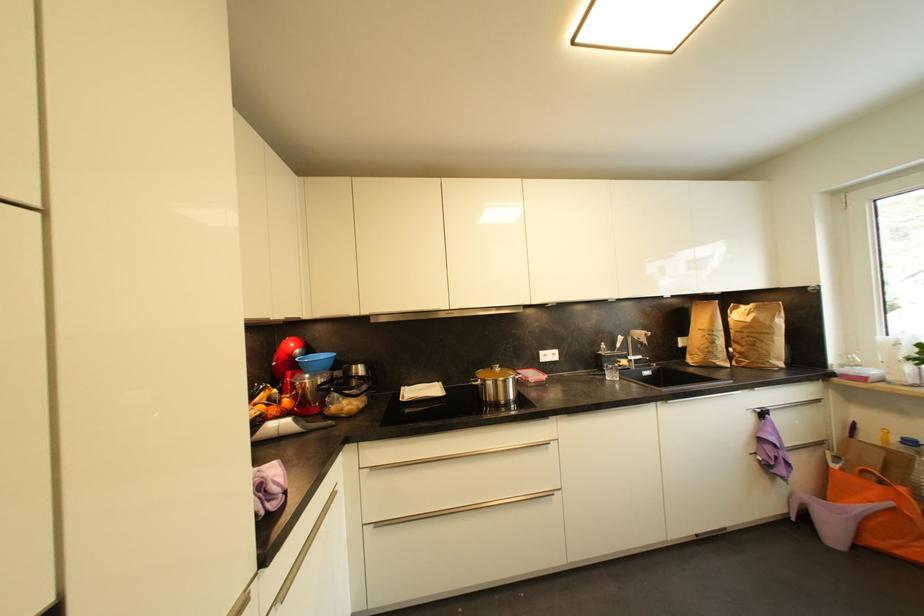
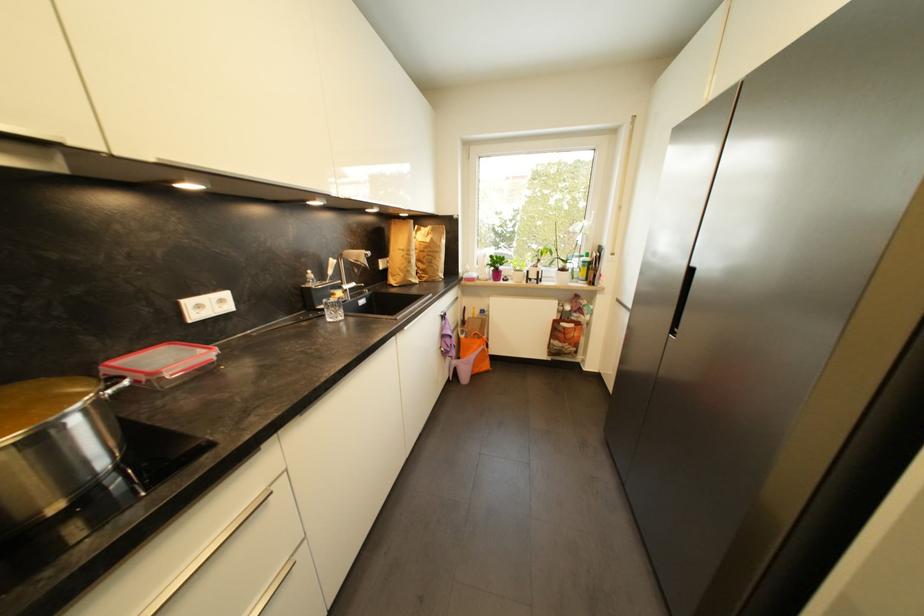
The point at (718, 345) is marked in the first image. Where is the corresponding point in the second image?

(415, 264)